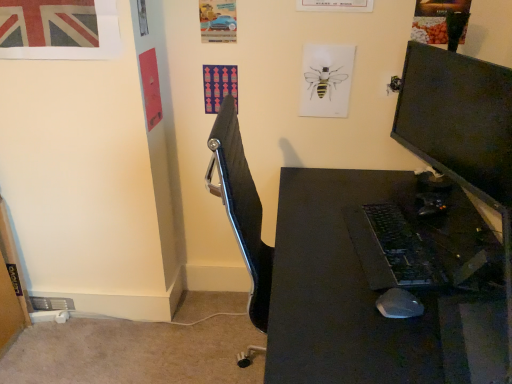
Locate an element on the screen. The image size is (512, 384). vacant space to the left of black plastic mouse at lower right is located at coordinates (333, 308).